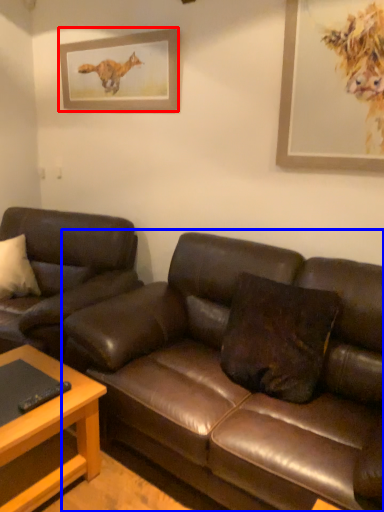
Question: Which object appears farthest to the camera in this image, picture frame (highlighted by a red box) or studio couch (highlighted by a blue box)?

Choices:
 (A) picture frame
 (B) studio couch

Answer: (A)